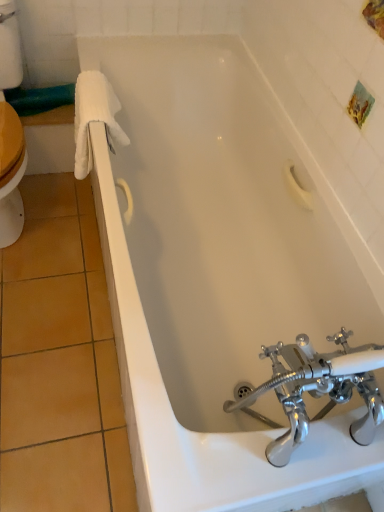
Question: Is white fluffy towel at left further to the viewer compared to polished chrome faucet at bottom right?

Choices:
 (A) no
 (B) yes

Answer: (B)

Question: From a real-world perspective, is white fluffy towel at left on top of polished chrome faucet at bottom right?

Choices:
 (A) yes
 (B) no

Answer: (B)

Question: Is white fluffy towel at left to the right of polished chrome faucet at bottom right from the viewer's perspective?

Choices:
 (A) yes
 (B) no

Answer: (B)

Question: Does white fluffy towel at left contain polished chrome faucet at bottom right?

Choices:
 (A) yes
 (B) no

Answer: (B)

Question: Can you confirm if white fluffy towel at left is bigger than polished chrome faucet at bottom right?

Choices:
 (A) yes
 (B) no

Answer: (B)

Question: Is white fluffy towel at left closer to camera compared to polished chrome faucet at bottom right?

Choices:
 (A) no
 (B) yes

Answer: (A)

Question: From a real-world perspective, is polished chrome faucet at bottom right on white fluffy towel at left?

Choices:
 (A) no
 (B) yes

Answer: (B)

Question: Considering the relative sizes of polished chrome faucet at bottom right and white fluffy towel at left in the image provided, is polished chrome faucet at bottom right thinner than white fluffy towel at left?

Choices:
 (A) yes
 (B) no

Answer: (B)

Question: Is polished chrome faucet at bottom right smaller than white fluffy towel at left?

Choices:
 (A) yes
 (B) no

Answer: (B)

Question: Could you tell me if polished chrome faucet at bottom right is turned towards white fluffy towel at left?

Choices:
 (A) no
 (B) yes

Answer: (B)

Question: Is polished chrome faucet at bottom right to the left of white fluffy towel at left from the viewer's perspective?

Choices:
 (A) yes
 (B) no

Answer: (B)

Question: Can you confirm if polished chrome faucet at bottom right is shorter than white fluffy towel at left?

Choices:
 (A) yes
 (B) no

Answer: (B)

Question: From the image's perspective, relative to white fluffy towel at left, is polished chrome faucet at bottom right above or below?

Choices:
 (A) below
 (B) above

Answer: (A)